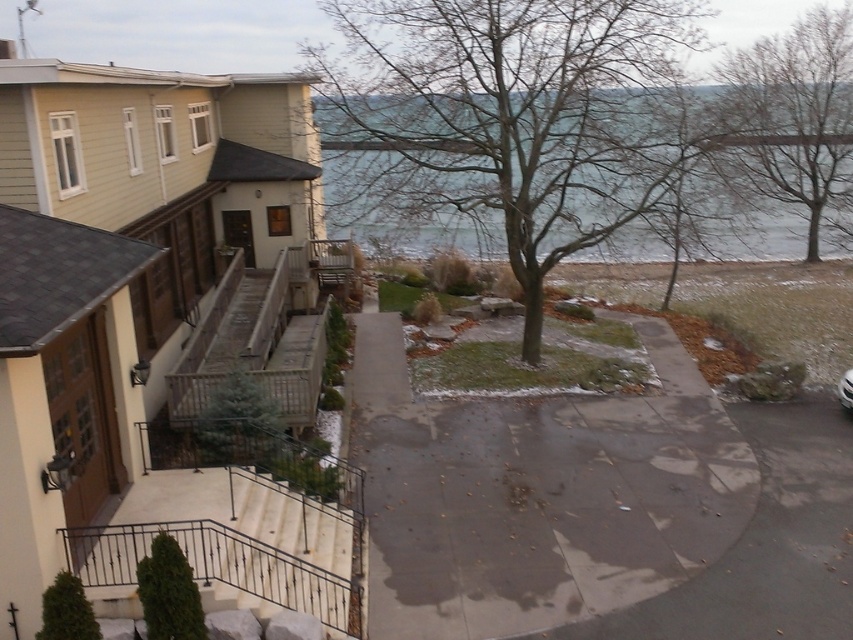
Question: Which point is closer to the camera taking this photo?

Choices:
 (A) (239, 378)
 (B) (595, 120)

Answer: (A)

Question: Is bare branches at center smaller than green matte evergreen tree at lower left?

Choices:
 (A) no
 (B) yes

Answer: (A)

Question: Which point appears farthest from the camera in this image?

Choices:
 (A) (207, 394)
 (B) (641, 48)
 (C) (177, 566)

Answer: (B)

Question: Is bare branches at center below green matte tree at center?

Choices:
 (A) yes
 (B) no

Answer: (B)

Question: Among these points, which one is nearest to the camera?

Choices:
 (A) (48, 616)
 (B) (224, 385)

Answer: (A)

Question: Is bare branches at center behind white glossy car at center?

Choices:
 (A) no
 (B) yes

Answer: (B)